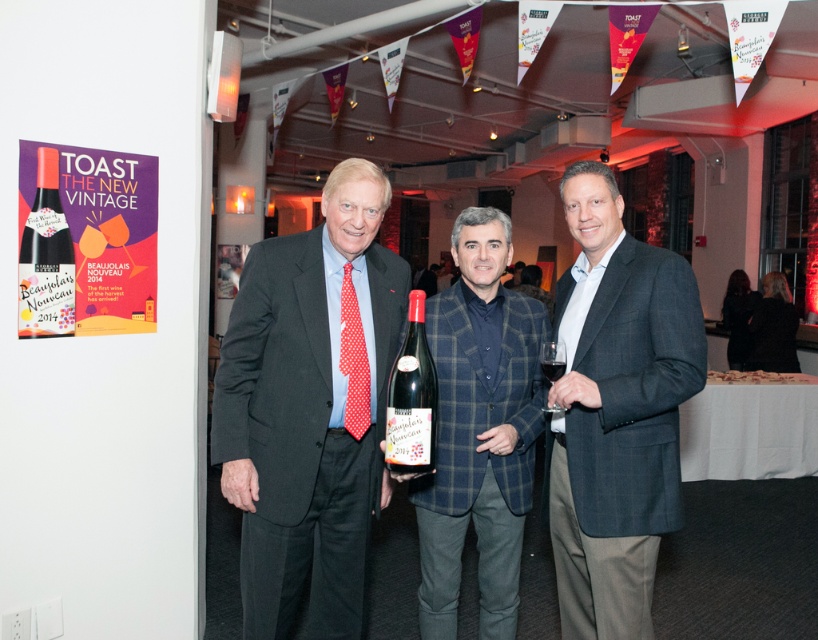
Does matte black suit at center have a larger size compared to clear glass wine at center?

Indeed, matte black suit at center has a larger size compared to clear glass wine at center.

Which is behind, point (288, 292) or point (551, 368)?

Positioned behind is point (288, 292).

I want to click on matte black suit at center, so click(x=309, y=406).

Does matte black suit at center appear under matte black wine bottle at upper left?

Yes.

Does matte black suit at center appear on the left side of matte black wine bottle at upper left?

In fact, matte black suit at center is to the right of matte black wine bottle at upper left.

Identify the location of matte black suit at center. Image resolution: width=818 pixels, height=640 pixels. (309, 406).

Locate an element on the screen. dark gray textured blazer at center is located at coordinates (616, 412).

Does dark gray textured blazer at center come behind matte black wine bottle at upper left?

No.

Is point (560, 282) positioned before point (25, 248)?

That is False.

Find the location of `dark gray textured blazer at center`. dark gray textured blazer at center is located at coordinates (616, 412).